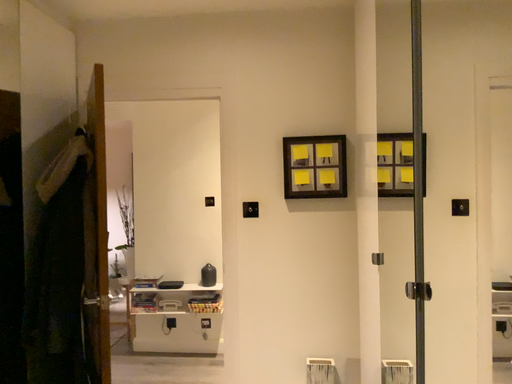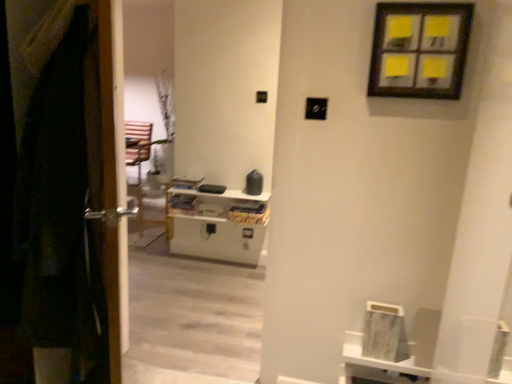
Question: How did the camera likely rotate when shooting the video?

Choices:
 (A) rotated downward
 (B) rotated upward

Answer: (A)